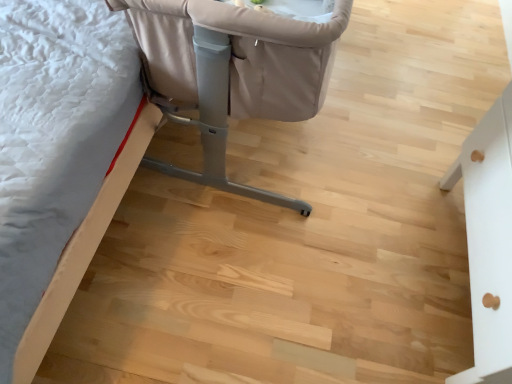
Identify the location of vacant space to the right of beige fabric crib at upper center, arranged as the second furniture when viewed from the left. (397, 117).